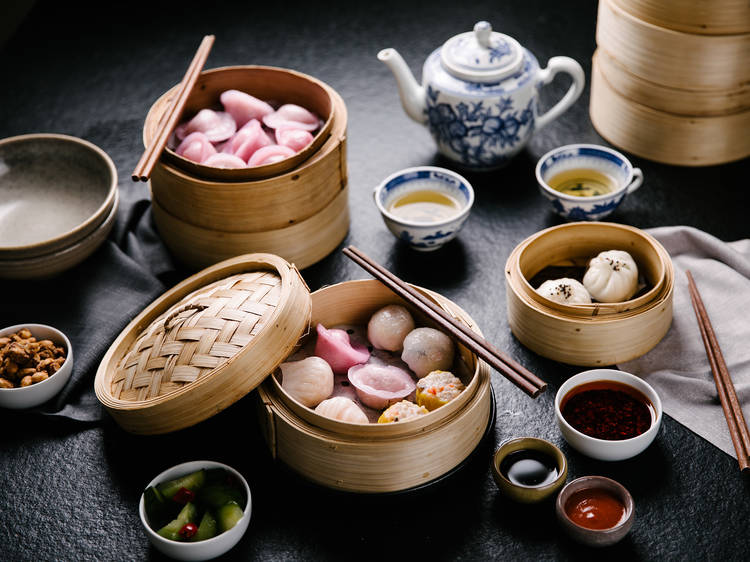
What are the coordinates of `black tabletop` in the screenshot? It's located at (375, 135).